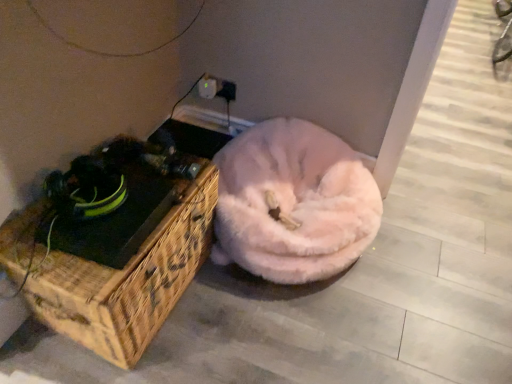
Question: Can you confirm if woven wood chest at left is thinner than white plastic electric outlet at upper center?

Choices:
 (A) no
 (B) yes

Answer: (A)

Question: Does woven wood chest at left have a smaller size compared to white plastic electric outlet at upper center?

Choices:
 (A) no
 (B) yes

Answer: (A)

Question: Does woven wood chest at left appear on the left side of white plastic electric outlet at upper center?

Choices:
 (A) no
 (B) yes

Answer: (B)

Question: Is woven wood chest at left further to the viewer compared to white plastic electric outlet at upper center?

Choices:
 (A) no
 (B) yes

Answer: (A)

Question: Is white plastic electric outlet at upper center at the back of woven wood chest at left?

Choices:
 (A) no
 (B) yes

Answer: (A)

Question: Looking at their shapes, would you say white plastic electric outlet at upper center is wider or thinner than woven wood chest at left?

Choices:
 (A) thin
 (B) wide

Answer: (A)

Question: Based on their positions, is white plastic electric outlet at upper center located to the left or right of woven wood chest at left?

Choices:
 (A) right
 (B) left

Answer: (A)

Question: From a real-world perspective, is white plastic electric outlet at upper center positioned above or below woven wood chest at left?

Choices:
 (A) above
 (B) below

Answer: (A)

Question: Is white plastic electric outlet at upper center in front of or behind woven wood chest at left in the image?

Choices:
 (A) front
 (B) behind

Answer: (B)

Question: Is fuzzy pink dog bed at center inside the boundaries of white plastic electric outlet at upper center, or outside?

Choices:
 (A) inside
 (B) outside

Answer: (B)

Question: Is point (330, 223) positioned closer to the camera than point (207, 87)?

Choices:
 (A) farther
 (B) closer

Answer: (B)

Question: Is fuzzy pink dog bed at center taller or shorter than white plastic electric outlet at upper center?

Choices:
 (A) tall
 (B) short

Answer: (A)

Question: In the image, is fuzzy pink dog bed at center positioned in front of or behind white plastic electric outlet at upper center?

Choices:
 (A) behind
 (B) front

Answer: (B)

Question: Is fuzzy pink dog bed at center taller or shorter than woven wood chest at left?

Choices:
 (A) tall
 (B) short

Answer: (B)

Question: Would you say fuzzy pink dog bed at center is inside or outside woven wood chest at left?

Choices:
 (A) inside
 (B) outside

Answer: (B)